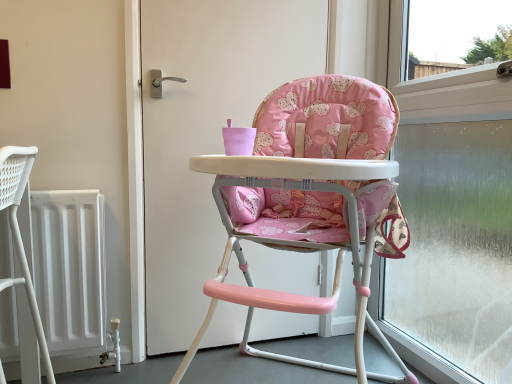
Find the location of a particular element. This screenshot has width=512, height=384. frosted glass window at right is located at coordinates (452, 218).

Identify the location of chair that is on the right side of pink fabric high chair at center. The width and height of the screenshot is (512, 384). (309, 199).

Who is smaller, pink fabric high chair at center or pink fabric highchair at center?

With smaller size is pink fabric high chair at center.

Is the depth of pink fabric high chair at center greater than that of pink fabric highchair at center?

Yes, it is behind pink fabric highchair at center.

Can you confirm if pink fabric high chair at center is thinner than pink fabric highchair at center?

Indeed, pink fabric high chair at center has a lesser width compared to pink fabric highchair at center.

From the image's perspective, which one is positioned higher, pink fabric highchair at center or pink fabric high chair at center?

pink fabric high chair at center.

Does pink fabric highchair at center have a greater width compared to pink fabric high chair at center?

Yes, pink fabric highchair at center is wider than pink fabric high chair at center.

Can you confirm if pink fabric highchair at center is shorter than pink fabric high chair at center?

Correct, pink fabric highchair at center is not as tall as pink fabric high chair at center.

From a real-world perspective, is pink fabric highchair at center positioned over pink fabric high chair at center based on gravity?

No, from a real-world perspective, pink fabric highchair at center is not over pink fabric high chair at center

Is pink fabric highchair at center in front of or behind frosted glass window at right in the image?

pink fabric highchair at center is in front of frosted glass window at right.

Could you tell me if pink fabric highchair at center is turned towards frosted glass window at right?

No, pink fabric highchair at center is not turned towards frosted glass window at right.

How far apart are pink fabric highchair at center and frosted glass window at right?

pink fabric highchair at center and frosted glass window at right are 23.12 inches apart.

Which is correct: pink fabric highchair at center is inside frosted glass window at right, or outside of it?

pink fabric highchair at center is not enclosed by frosted glass window at right.

Is frosted glass window at right further to camera compared to pink fabric highchair at center?

Yes, it is behind pink fabric highchair at center.

Can you confirm if frosted glass window at right is taller than pink fabric highchair at center?

Indeed, frosted glass window at right has a greater height compared to pink fabric highchair at center.

Is pink fabric highchair at center at the back of frosted glass window at right?

That's right, frosted glass window at right is facing away from pink fabric highchair at center.

Which of these two, frosted glass window at right or pink fabric highchair at center, is wider?

pink fabric highchair at center.

Is pink fabric high chair at center spatially inside frosted glass window at right, or outside of it?

pink fabric high chair at center exists outside the volume of frosted glass window at right.

You are a GUI agent. You are given a task and a screenshot of the screen. Output one action in this format:
    pyautogui.click(x=<x>, y=<y>)
    Task: Click on the window screen that appears below the pink fabric high chair at center (from a real-world perspective)
    This screenshot has width=512, height=384.
    Given the screenshot: What is the action you would take?
    pyautogui.click(x=452, y=218)

Which object is closer to the camera taking this photo, pink fabric high chair at center or frosted glass window at right?

frosted glass window at right is in front.

From a real-world perspective, is frosted glass window at right under pink fabric high chair at center?

Correct, in the physical world, frosted glass window at right is lower than pink fabric high chair at center.

Can you tell me how much frosted glass window at right and pink fabric high chair at center differ in facing direction?

89.4 degrees separate the facing orientations of frosted glass window at right and pink fabric high chair at center.

From the picture: Which of these two, frosted glass window at right or pink fabric high chair at center, is bigger?

frosted glass window at right is bigger.

Is pink fabric high chair at center surrounded by frosted glass window at right?

Definitely not — pink fabric high chair at center is not inside frosted glass window at right.

You are a GUI agent. You are given a task and a screenshot of the screen. Output one action in this format:
    pyautogui.click(x=<x>, y=<y>)
    Task: Click on the chair on the right side of pink fabric high chair at center
    
    Given the screenshot: What is the action you would take?
    pyautogui.click(x=309, y=199)

At what (x,y) coordinates should I click in order to perform the action: click on screen door that is above the pink fabric highchair at center (from a real-world perspective). Please return your answer as a coordinate pair (x, y). Looking at the image, I should click on (206, 132).

Which object lies further to the anchor point pink fabric high chair at center, frosted glass window at right or pink fabric highchair at center?

Among the two, frosted glass window at right is located further to pink fabric high chair at center.

From the image, which object appears to be farther from pink fabric highchair at center, pink fabric high chair at center or frosted glass window at right?

frosted glass window at right lies further to pink fabric highchair at center than the other object.

From the image, which object appears to be nearer to frosted glass window at right, pink fabric high chair at center or pink fabric highchair at center?

Based on the image, pink fabric highchair at center appears to be nearer to frosted glass window at right.

Looking at this image, considering their positions, is pink fabric highchair at center positioned further to pink fabric high chair at center than frosted glass window at right?

The object further to pink fabric high chair at center is frosted glass window at right.

Based on their spatial positions, is frosted glass window at right or pink fabric high chair at center further from pink fabric highchair at center?

The object further to pink fabric highchair at center is frosted glass window at right.

Estimate the real-world distances between objects in this image. Which object is further from frosted glass window at right, pink fabric highchair at center or pink fabric high chair at center?

pink fabric high chair at center is further to frosted glass window at right.

Where is `window screen located between pink fabric highchair at center and pink fabric high chair at center in the depth direction`? The height and width of the screenshot is (384, 512). window screen located between pink fabric highchair at center and pink fabric high chair at center in the depth direction is located at coordinates (452, 218).